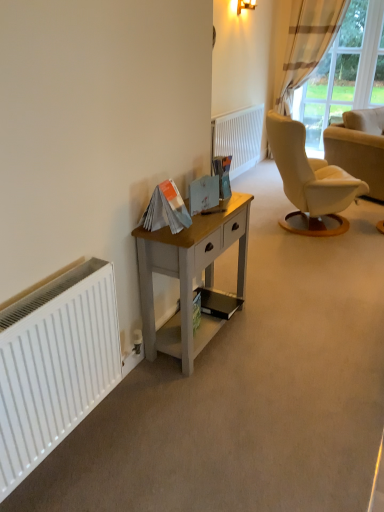
Find the location of `vacant space in front of light gray wood desk at center`. vacant space in front of light gray wood desk at center is located at coordinates coord(213,394).